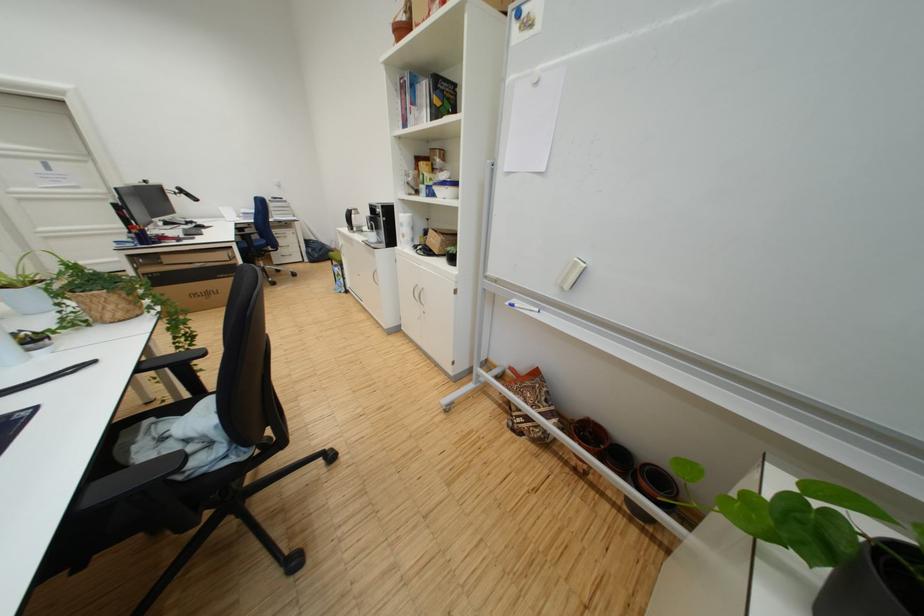
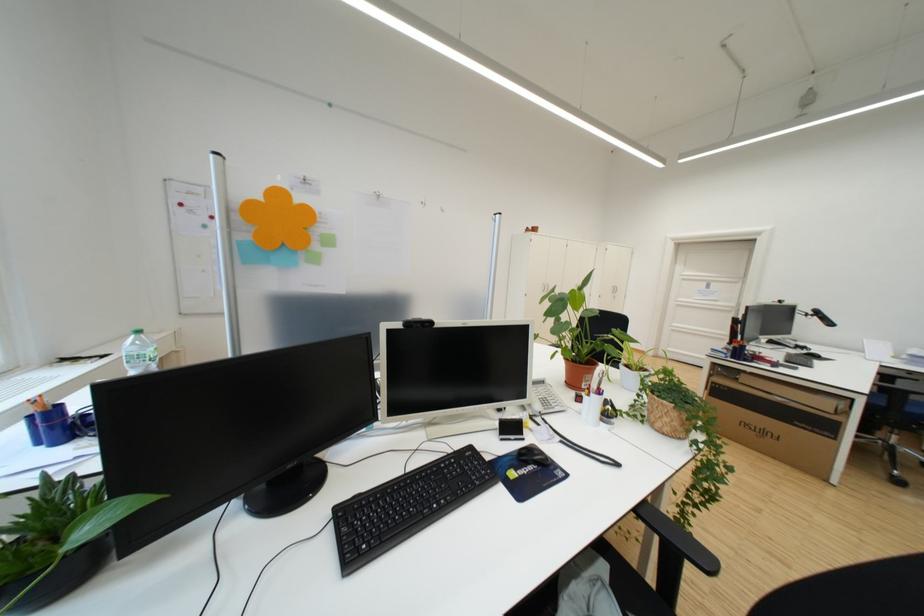
Where in the second image is the point corresponding to (x=127, y=300) from the first image?

(687, 416)